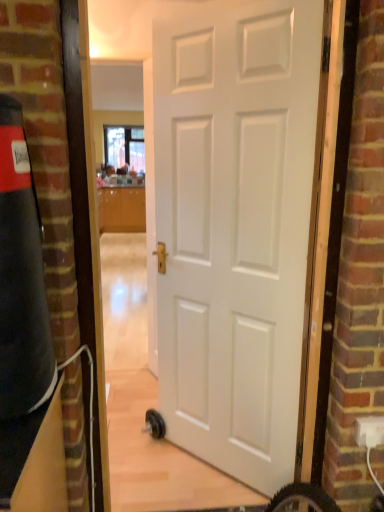
Question: From a real-world perspective, is clear glass window at upper center on top of white plastic electric outlet at lower right?

Choices:
 (A) yes
 (B) no

Answer: (A)

Question: Is white plastic electric outlet at lower right a part of clear glass window at upper center?

Choices:
 (A) no
 (B) yes

Answer: (A)

Question: Considering the relative positions of clear glass window at upper center and white plastic electric outlet at lower right in the image provided, is clear glass window at upper center in front of white plastic electric outlet at lower right?

Choices:
 (A) no
 (B) yes

Answer: (A)

Question: From the image's perspective, is clear glass window at upper center beneath white plastic electric outlet at lower right?

Choices:
 (A) no
 (B) yes

Answer: (A)

Question: Does clear glass window at upper center have a greater width compared to white plastic electric outlet at lower right?

Choices:
 (A) no
 (B) yes

Answer: (B)

Question: Are clear glass window at upper center and white plastic electric outlet at lower right beside each other?

Choices:
 (A) no
 (B) yes

Answer: (A)

Question: Is white matte door at center smaller than glossy wood cabinetry at center?

Choices:
 (A) yes
 (B) no

Answer: (A)

Question: Could you tell me if white matte door at center is facing glossy wood cabinetry at center?

Choices:
 (A) no
 (B) yes

Answer: (A)

Question: Can you confirm if white matte door at center is positioned to the right of glossy wood cabinetry at center?

Choices:
 (A) yes
 (B) no

Answer: (A)

Question: Considering the relative sizes of white matte door at center and glossy wood cabinetry at center in the image provided, is white matte door at center wider than glossy wood cabinetry at center?

Choices:
 (A) yes
 (B) no

Answer: (B)

Question: Does white matte door at center have a larger size compared to glossy wood cabinetry at center?

Choices:
 (A) no
 (B) yes

Answer: (A)

Question: Are white matte door at center and glossy wood cabinetry at center located far from each other?

Choices:
 (A) yes
 (B) no

Answer: (A)

Question: Is clear glass window at upper center completely or partially inside white matte door at center?

Choices:
 (A) no
 (B) yes

Answer: (A)